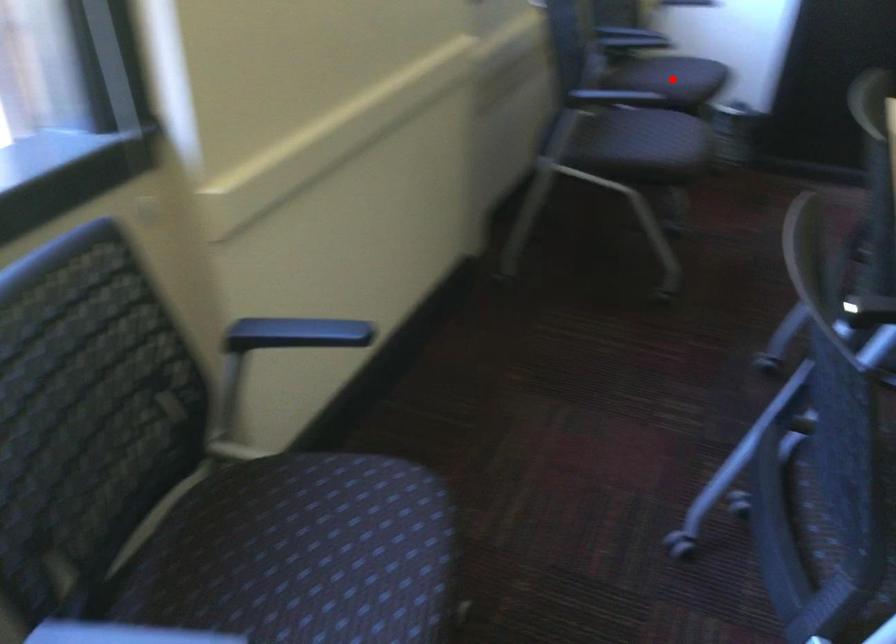
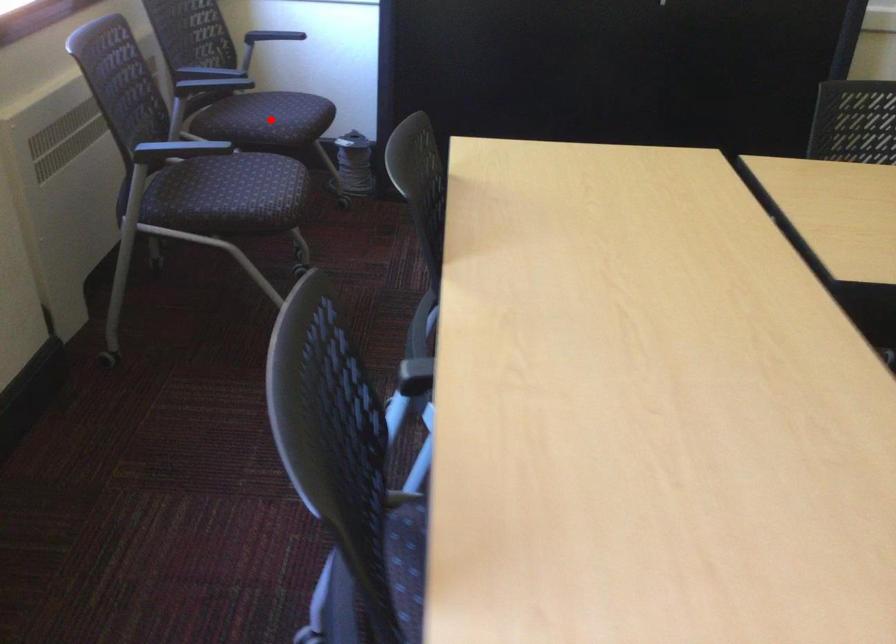
I am providing you with two images of the same scene from different viewpoints. A red point is marked on the first image and another point is marked on the second image. Does the point marked in image1 correspond to the same location as the one in image2?

Yes